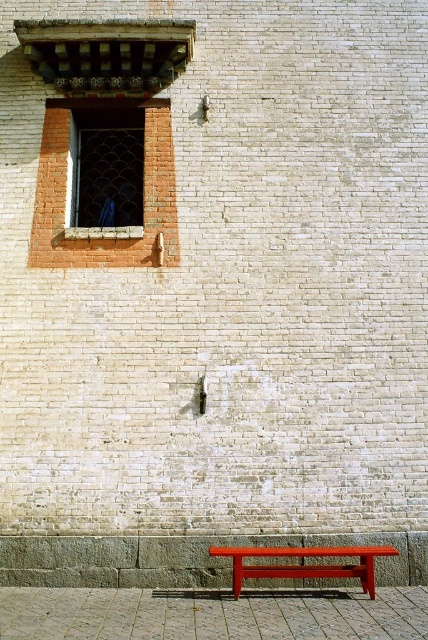
Is matte glass window at upper left smaller than matte red bench at lower center?

Yes.

Where is `matte glass window at upper left`? Image resolution: width=428 pixels, height=640 pixels. matte glass window at upper left is located at coordinates (107, 168).

Where is `matte glass window at upper left`? matte glass window at upper left is located at coordinates (107, 168).